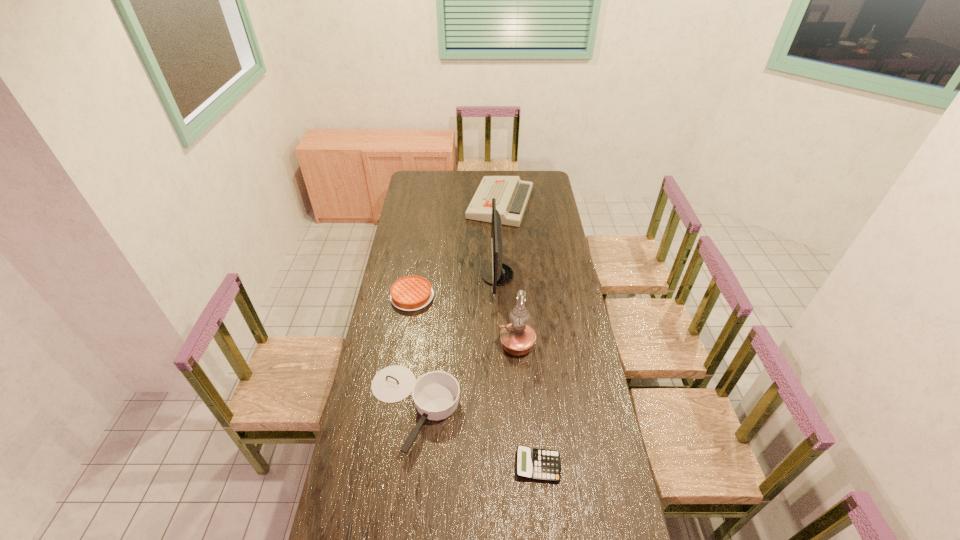
The width and height of the screenshot is (960, 540). I want to click on free space located on the front of the computer keyboard, so pyautogui.click(x=504, y=264).

The height and width of the screenshot is (540, 960). Find the location of `free space located on the back of the saucepan`. free space located on the back of the saucepan is located at coordinates (423, 323).

Locate an element on the screen. free location located 0.190m on the right of the third shortest object is located at coordinates (473, 296).

Identify the location of vacant space located on the back of the sixth tallest object. (533, 408).

Where is `object that is at the far edge`? object that is at the far edge is located at coordinates (512, 194).

The image size is (960, 540). Identify the location of saucepan positioned at the left edge. (436, 394).

The image size is (960, 540). In order to click on pie situated at the left edge in this screenshot , I will do `click(410, 293)`.

I want to click on object situated at the right edge, so click(512, 194).

The width and height of the screenshot is (960, 540). What are the coordinates of `object at the far right corner` in the screenshot? It's located at (512, 194).

Image resolution: width=960 pixels, height=540 pixels. In order to click on blank space at the far edge of the desktop in this screenshot , I will do `click(456, 180)`.